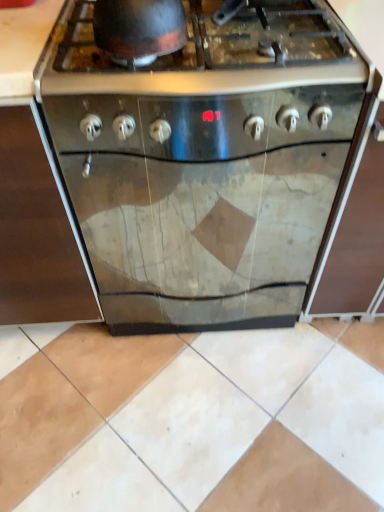
Question: Does shiny black wok at upper center have a greater height compared to stainless steel oven at center?

Choices:
 (A) yes
 (B) no

Answer: (B)

Question: Is stainless steel oven at center surrounded by shiny black wok at upper center?

Choices:
 (A) yes
 (B) no

Answer: (B)

Question: Is shiny black wok at upper center oriented away from stainless steel oven at center?

Choices:
 (A) no
 (B) yes

Answer: (A)

Question: Are shiny black wok at upper center and stainless steel oven at center located far from each other?

Choices:
 (A) no
 (B) yes

Answer: (A)

Question: Can you confirm if shiny black wok at upper center is smaller than stainless steel oven at center?

Choices:
 (A) no
 (B) yes

Answer: (B)

Question: From a real-world perspective, is stainless steel oven at center physically located above or below shiny black wok at upper center?

Choices:
 (A) below
 (B) above

Answer: (A)

Question: Is stainless steel oven at center spatially inside shiny black wok at upper center, or outside of it?

Choices:
 (A) inside
 (B) outside

Answer: (B)

Question: From the image's perspective, is stainless steel oven at center above or below shiny black wok at upper center?

Choices:
 (A) below
 (B) above

Answer: (A)

Question: Is stainless steel oven at center bigger or smaller than shiny black wok at upper center?

Choices:
 (A) big
 (B) small

Answer: (A)

Question: In terms of width, does shiny black wok at upper center look wider or thinner when compared to stainless steel oven at center?

Choices:
 (A) wide
 (B) thin

Answer: (B)

Question: In terms of height, does shiny black wok at upper center look taller or shorter compared to stainless steel oven at center?

Choices:
 (A) short
 (B) tall

Answer: (A)

Question: From the image's perspective, is shiny black wok at upper center located above or below stainless steel oven at center?

Choices:
 (A) below
 (B) above

Answer: (B)

Question: Considering their positions, is shiny black wok at upper center located in front of or behind stainless steel oven at center?

Choices:
 (A) front
 (B) behind

Answer: (A)

Question: Considering the positions of stainless steel oven at left and shiny black wok at upper center in the image, is stainless steel oven at left taller or shorter than shiny black wok at upper center?

Choices:
 (A) short
 (B) tall

Answer: (B)

Question: From a real-world perspective, is stainless steel oven at left physically located above or below shiny black wok at upper center?

Choices:
 (A) below
 (B) above

Answer: (A)